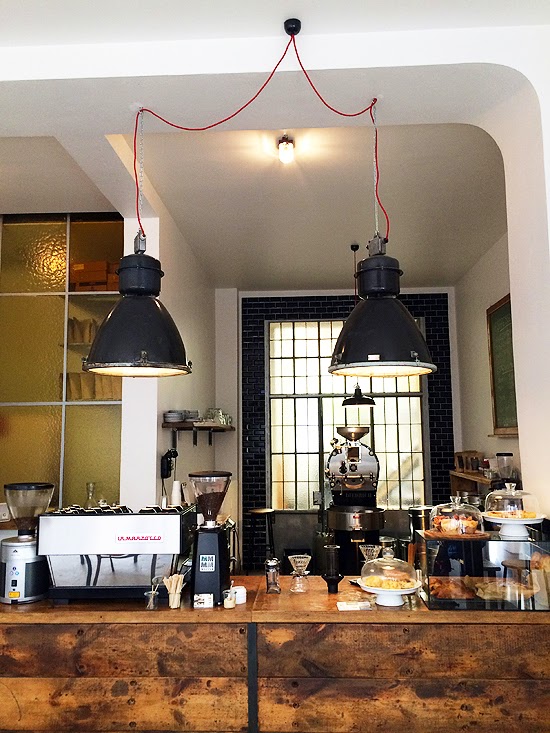
Image resolution: width=550 pixels, height=733 pixels. What are the coordinates of `coffee press` in the screenshot? It's located at (362, 470).